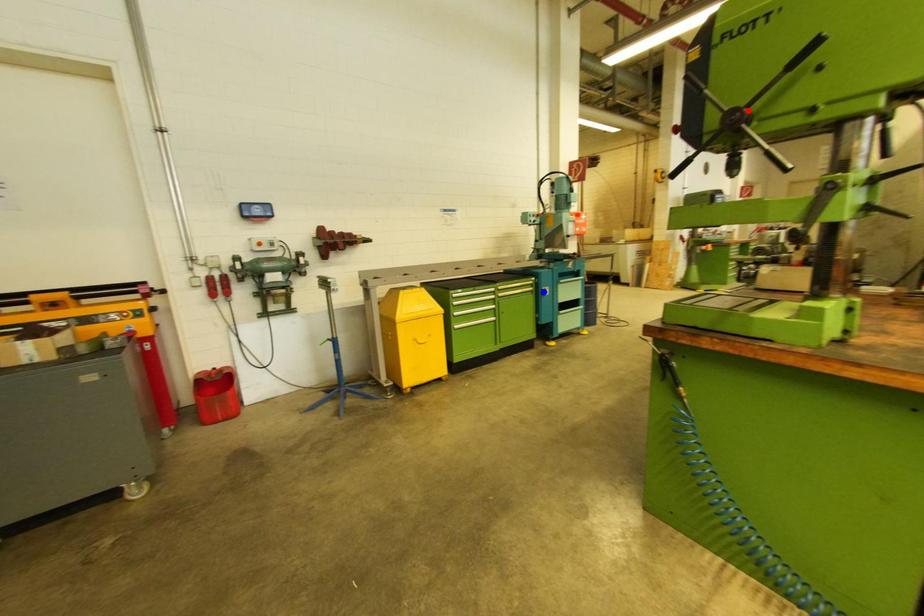
Question: Two points are marked on the image. Which point is closer to the camera?

Choices:
 (A) Blue point is closer.
 (B) Red point is closer.

Answer: (B)